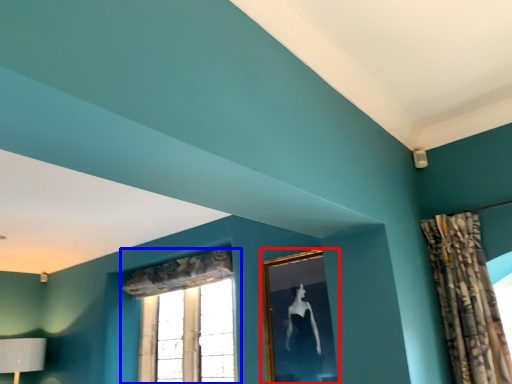
Question: Among these objects, which one is nearest to the camera, picture frame (highlighted by a red box) or window (highlighted by a blue box)?

Choices:
 (A) picture frame
 (B) window

Answer: (A)